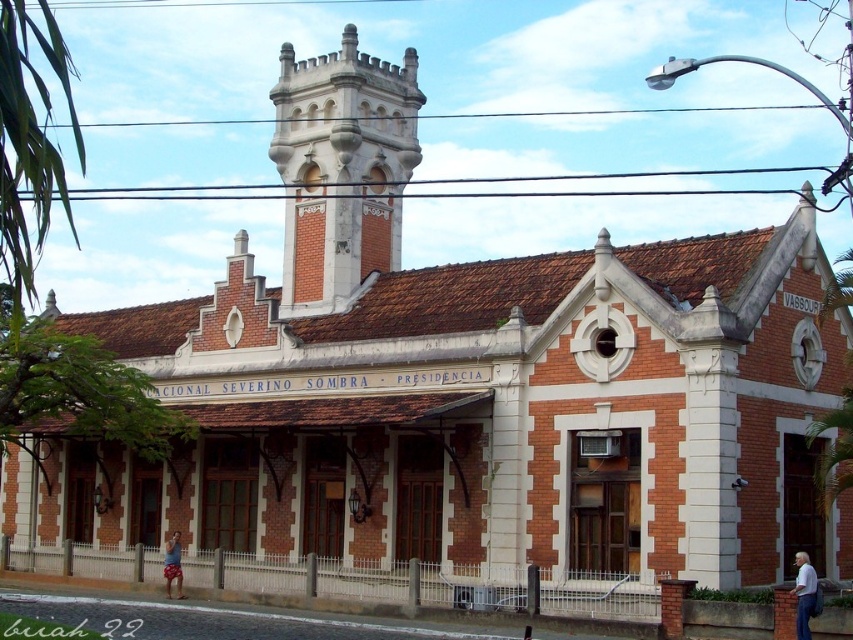
You are a fashion designer observing the historic building scene. You notice a white cotton shirt at lower right and beige shorts at lower left. Which clothing item appears bigger in the image?

The white cotton shirt at lower right is larger in size than the beige shorts at lower left, so the white cotton shirt at lower right appears bigger in the image.

You are standing in front of the historic building and want to locate the red brick bell tower at upper center. According to the coordinates provided, where exactly is it positioned?

The red brick bell tower at upper center is located at point (x=341, y=170), which means it is positioned slightly to the left and above the center of the building.